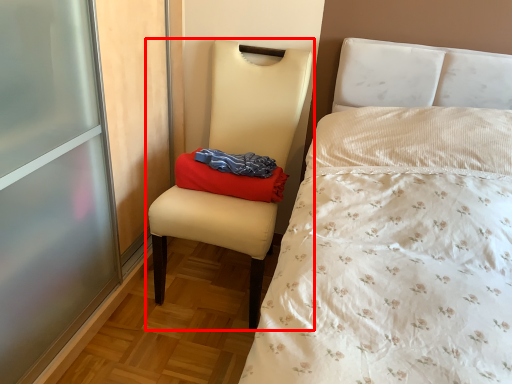
Question: In this image, where is chair (annotated by the red box) located relative to pillow?

Choices:
 (A) right
 (B) left

Answer: (B)